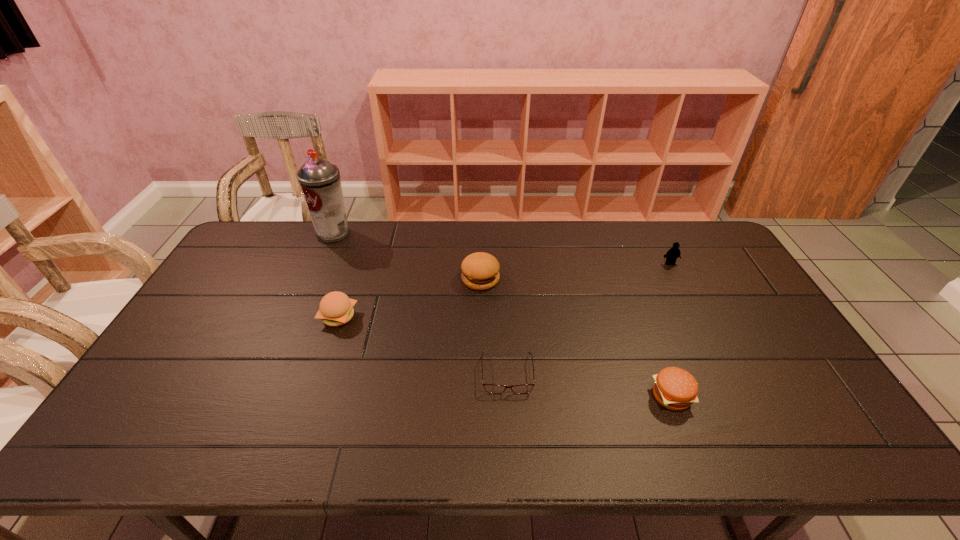
Image resolution: width=960 pixels, height=540 pixels. I want to click on free area in between the fifth object from right to left and the Lego, so click(504, 290).

Where is `unoccupied position between the second hamburger from left to right and the rightmost object`? The width and height of the screenshot is (960, 540). unoccupied position between the second hamburger from left to right and the rightmost object is located at coordinates (575, 271).

Point out which object is positioned as the third nearest to the aerosol can. Please provide its 2D coordinates. Your answer should be formatted as a tuple, i.e. [(x, y)], where the tuple contains the x and y coordinates of a point satisfying the conditions above.

[(490, 388)]

Find the location of a particular element. Image resolution: width=960 pixels, height=540 pixels. the second closest object to the third farthest object is located at coordinates (336, 308).

Locate which hamburger ranks second in proximity to the farthest object. Please provide its 2D coordinates. Your answer should be formatted as a tuple, i.e. [(x, y)], where the tuple contains the x and y coordinates of a point satisfying the conditions above.

[(480, 271)]

Locate which hamburger ranks third in proximity to the spectacles. Please provide its 2D coordinates. Your answer should be formatted as a tuple, i.e. [(x, y)], where the tuple contains the x and y coordinates of a point satisfying the conditions above.

[(336, 308)]

At what (x,y) coordinates should I click in order to perform the action: click on vacant space that satisfies the following two spatial constraints: 1. on the front side of the fifth tallest object; 2. on the left side of the second hamburger from left to right. Please return your answer as a coordinate pair (x, y). Image resolution: width=960 pixels, height=540 pixels. Looking at the image, I should click on (481, 396).